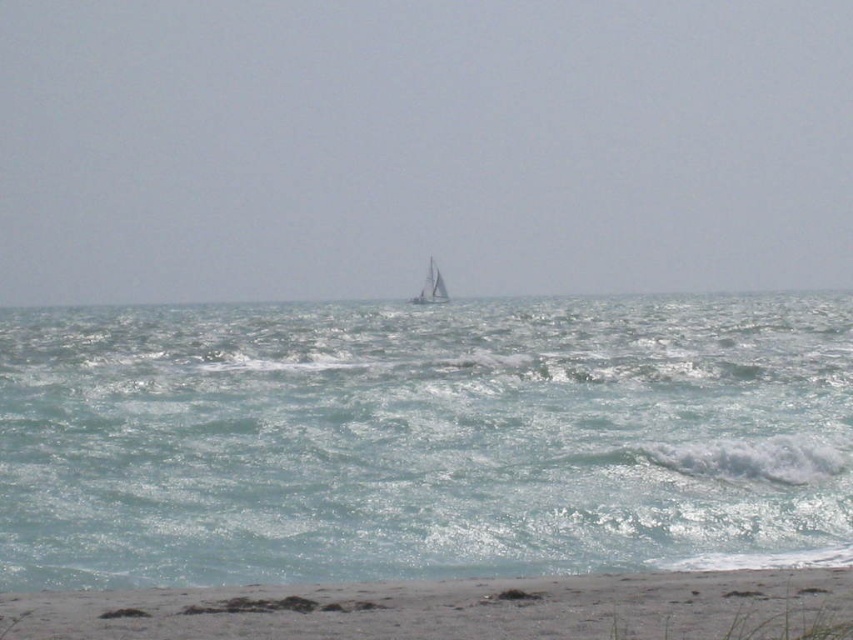
Which is above, clear blue water at center or white sailboat at center?

white sailboat at center is higher up.

Is point (303, 556) farther from viewer compared to point (422, 294)?

No.

This screenshot has width=853, height=640. I want to click on clear blue water at center, so click(x=422, y=438).

Does point (451, 353) come behind point (13, 634)?

Yes, point (451, 353) is farther from viewer.

Does clear blue water at center have a smaller size compared to sandy beach at lower center?

Actually, clear blue water at center might be larger than sandy beach at lower center.

Does point (223, 312) come closer to viewer compared to point (15, 627)?

No, (223, 312) is behind (15, 627).

You are a GUI agent. You are given a task and a screenshot of the screen. Output one action in this format:
    pyautogui.click(x=<x>, y=<y>)
    Task: Click on the clear blue water at center
    
    Given the screenshot: What is the action you would take?
    pyautogui.click(x=422, y=438)

Is sandy beach at lower center positioned before white sailboat at center?

Yes, sandy beach at lower center is closer to the viewer.

Between sandy beach at lower center and white sailboat at center, which one appears on the left side from the viewer's perspective?

From the viewer's perspective, white sailboat at center appears more on the left side.

Does point (277, 602) come behind point (431, 259)?

That is False.

The height and width of the screenshot is (640, 853). Find the location of `sandy beach at lower center`. sandy beach at lower center is located at coordinates (459, 609).